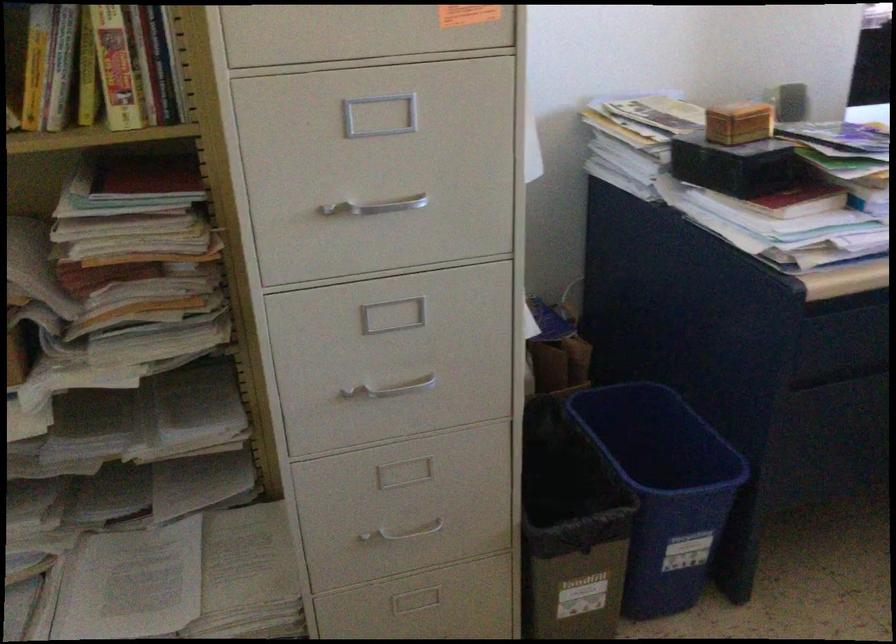
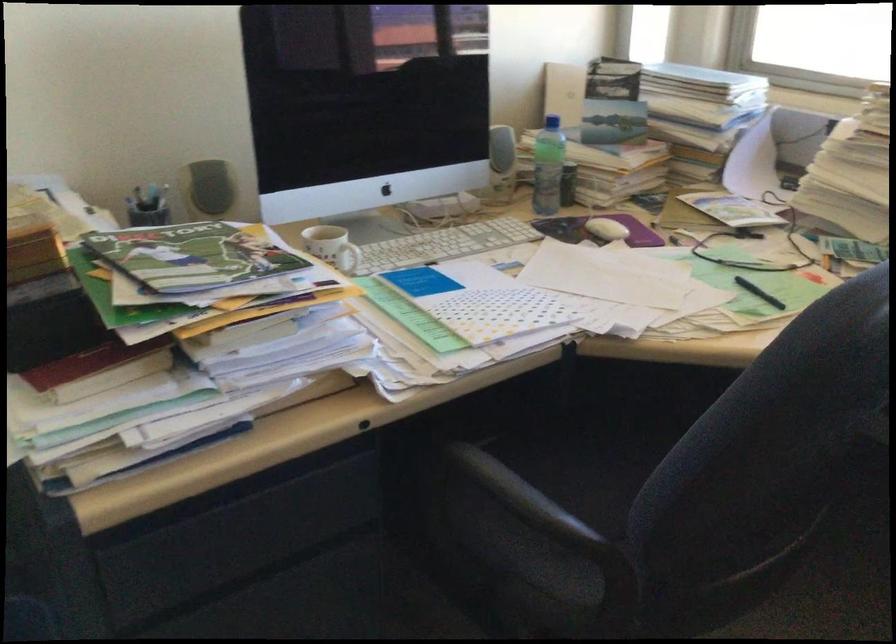
In a continuous first-person perspective shot, in which direction is the camera moving?

The cameraman walked toward right, forward.